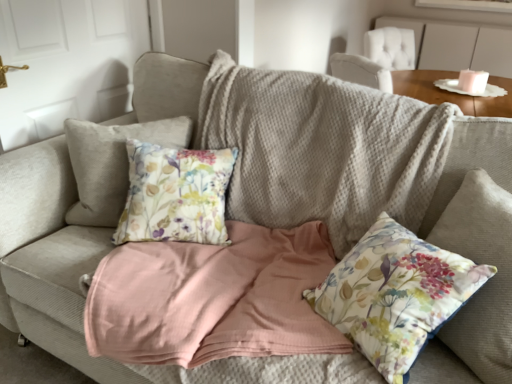
Question: Is wooden table at upper right bigger than floral fabric cushion at center?

Choices:
 (A) yes
 (B) no

Answer: (B)

Question: Can you confirm if wooden table at upper right is taller than floral fabric cushion at center?

Choices:
 (A) no
 (B) yes

Answer: (A)

Question: Does wooden table at upper right appear on the right side of floral fabric cushion at center?

Choices:
 (A) no
 (B) yes

Answer: (B)

Question: From a real-world perspective, is wooden table at upper right positioned under floral fabric cushion at center based on gravity?

Choices:
 (A) yes
 (B) no

Answer: (B)

Question: Is wooden table at upper right in front of floral fabric cushion at center?

Choices:
 (A) yes
 (B) no

Answer: (B)

Question: Is the depth of wooden table at upper right greater than that of floral fabric cushion at center?

Choices:
 (A) yes
 (B) no

Answer: (A)

Question: Is floral fabric cushion at center completely or partially outside of wooden table at upper right?

Choices:
 (A) no
 (B) yes

Answer: (B)

Question: From a real-world perspective, is floral fabric cushion at center positioned over wooden table at upper right based on gravity?

Choices:
 (A) yes
 (B) no

Answer: (B)

Question: Is floral fabric cushion at center not close to wooden table at upper right?

Choices:
 (A) no
 (B) yes

Answer: (A)

Question: Considering the relative sizes of floral fabric cushion at center and wooden table at upper right in the image provided, is floral fabric cushion at center taller than wooden table at upper right?

Choices:
 (A) no
 (B) yes

Answer: (B)

Question: Is the position of floral fabric cushion at center less distant than that of wooden table at upper right?

Choices:
 (A) yes
 (B) no

Answer: (A)

Question: From a real-world perspective, does floral fabric cushion at center sit lower than wooden table at upper right?

Choices:
 (A) no
 (B) yes

Answer: (B)

Question: Is point (455, 281) positioned closer to the camera than point (461, 105)?

Choices:
 (A) farther
 (B) closer

Answer: (B)